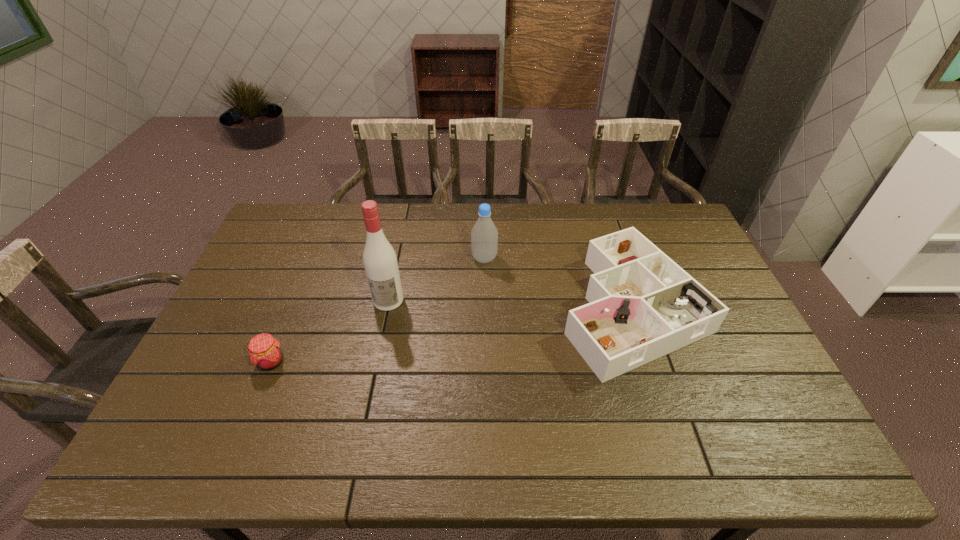
Image resolution: width=960 pixels, height=540 pixels. I want to click on free space between the rightmost object and the third shortest object, so click(558, 282).

Find the location of a particular element. empty space between the third shortest object and the jam is located at coordinates (378, 310).

Identify the location of unoccupied area between the rightmost object and the tallest object. This screenshot has width=960, height=540. (510, 303).

Locate an element on the screen. Image resolution: width=960 pixels, height=540 pixels. free point between the jam and the third object from right to left is located at coordinates (330, 331).

The height and width of the screenshot is (540, 960). Identify the location of free point between the dollhouse and the tallest object. (510, 303).

The width and height of the screenshot is (960, 540). I want to click on vacant area that lies between the alcohol and the dollhouse, so click(x=510, y=303).

Find the location of `free area in between the second object from left to right and the rightmost object`. free area in between the second object from left to right and the rightmost object is located at coordinates (510, 303).

At what (x,y) coordinates should I click in order to perform the action: click on free spot between the bottle and the jam. Please return your answer as a coordinate pair (x, y). This screenshot has width=960, height=540. Looking at the image, I should click on (378, 310).

Locate which object ranks in proximity to the tallest object. Please provide its 2D coordinates. Your answer should be formatted as a tuple, i.e. [(x, y)], where the tuple contains the x and y coordinates of a point satisfying the conditions above.

[(484, 235)]

Point out which object is positioned as the second nearest to the rightmost object. Please provide its 2D coordinates. Your answer should be formatted as a tuple, i.e. [(x, y)], where the tuple contains the x and y coordinates of a point satisfying the conditions above.

[(380, 261)]